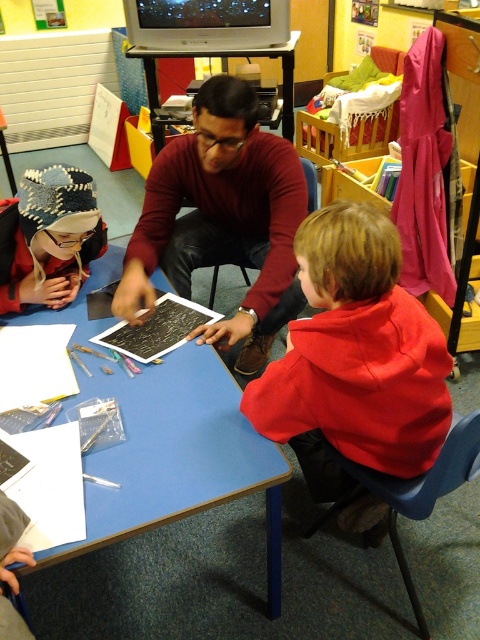
Question: Which point is farther from the camera taking this photo?

Choices:
 (A) (56, 221)
 (B) (279, 314)
 (C) (166, 362)
 (D) (347, 444)

Answer: (B)

Question: Which point is closer to the camera?

Choices:
 (A) blue plastic table at center
 (B) knitted wool hat at upper left
 (C) red fleece jacket at lower right

Answer: (A)

Question: From the image, what is the correct spatial relationship of red fleece jacket at lower right in relation to knitted wool hat at upper left?

Choices:
 (A) below
 (B) above

Answer: (A)

Question: Does maroon sweater at center appear on the left side of knitted wool hat at upper left?

Choices:
 (A) no
 (B) yes

Answer: (A)

Question: Is blue plastic table at center smaller than knitted wool hat at upper left?

Choices:
 (A) yes
 (B) no

Answer: (B)

Question: Which point appears closest to the camera in this image?

Choices:
 (A) (15, 308)
 (B) (409, 342)
 (C) (203, 129)

Answer: (B)